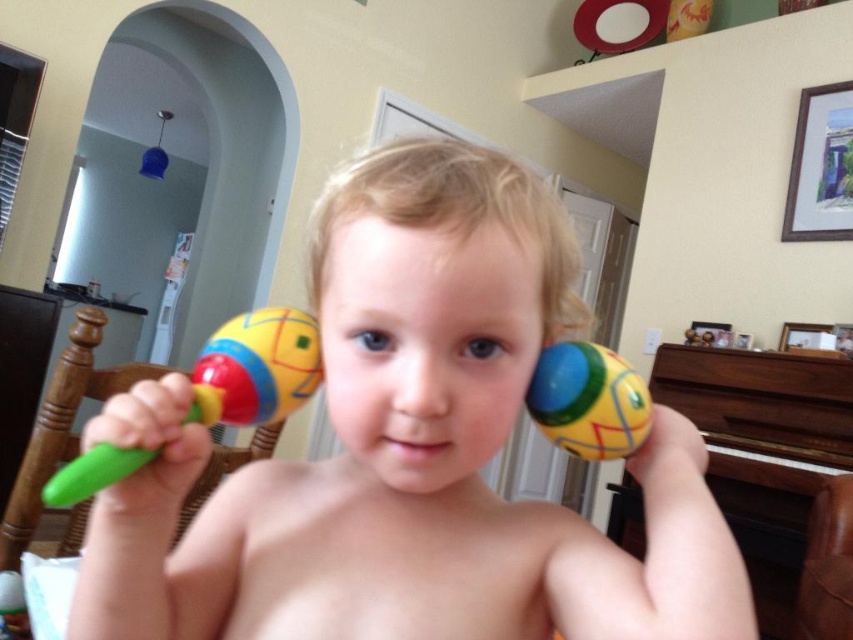
Question: Does matte plastic maracas at center appear on the right side of matte plastic maraca at left?

Choices:
 (A) no
 (B) yes

Answer: (B)

Question: Which is nearer to the matte plastic maracas at center?

Choices:
 (A) matte plastic maraca at right
 (B) matte plastic maraca at left

Answer: (A)

Question: Is matte plastic maracas at center to the left of matte plastic maraca at right from the viewer's perspective?

Choices:
 (A) yes
 (B) no

Answer: (A)

Question: Among these objects, which one is farthest from the camera?

Choices:
 (A) matte plastic maracas at center
 (B) matte plastic maraca at right
 (C) matte plastic maraca at left

Answer: (B)

Question: Which point is closer to the camera?

Choices:
 (A) (299, 356)
 (B) (619, 406)

Answer: (B)

Question: Can you confirm if matte plastic maraca at left is thinner than matte plastic maraca at right?

Choices:
 (A) no
 (B) yes

Answer: (A)